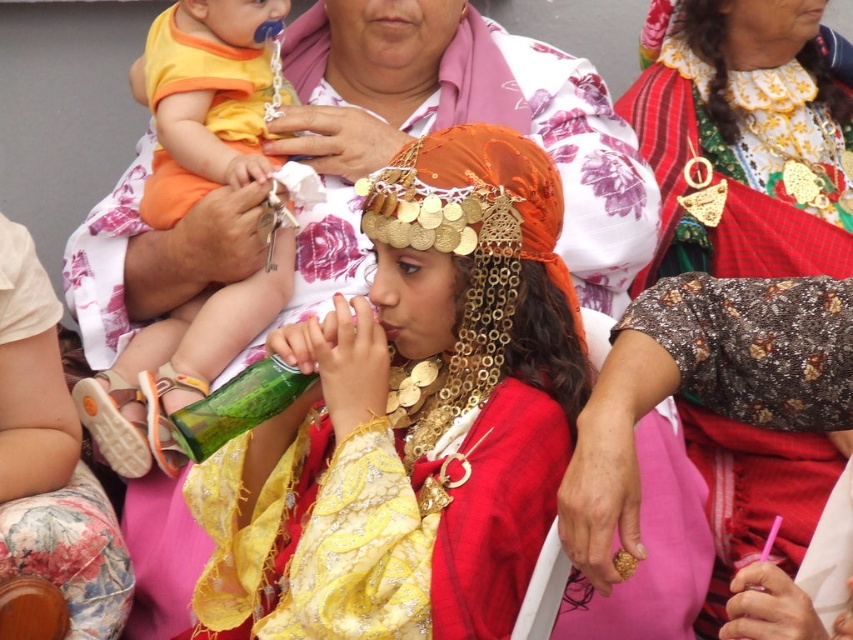
You are organizing a photo shoot and need to ensure that the floral fabric dress at center and the green glass bottle at center can fit within a 1.2 meter wide backdrop. Based on their sizes, will both items fit side by side?

The floral fabric dress at center is wider than the green glass bottle at center. Since the total width of both items combined would exceed 1.2 meters, they cannot fit side by side within the backdrop.

Based on the description, where is the shiny metallic headpiece at center located in the image?

The shiny metallic headpiece at center is located at the coordinates point [585,164].